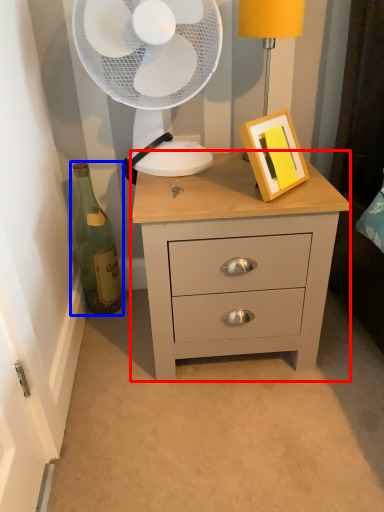
Question: Which object is further to the camera taking this photo, chest of drawers (highlighted by a red box) or bottle (highlighted by a blue box)?

Choices:
 (A) chest of drawers
 (B) bottle

Answer: (B)